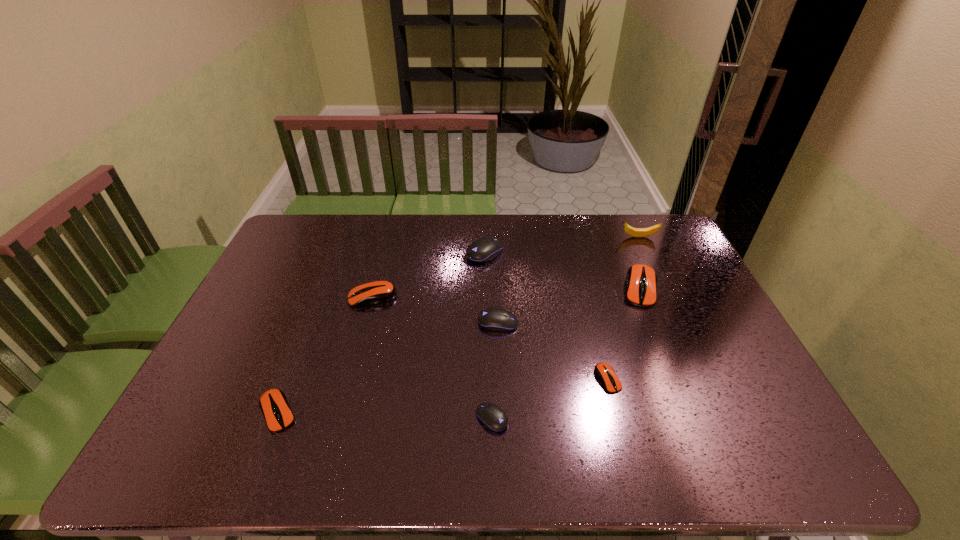
Locate an element on the screen. yellow banana is located at coordinates (635, 232).

Identify the location of the farthest object. (635, 232).

Where is `the rightmost orange computer mouse`? the rightmost orange computer mouse is located at coordinates (641, 280).

The width and height of the screenshot is (960, 540). Identify the location of the biggest orange computer mouse. (641, 280).

This screenshot has width=960, height=540. Identify the location of the farthest computer mouse. (482, 250).

The image size is (960, 540). In order to click on the farthest black computer mouse in this screenshot , I will do `click(482, 250)`.

At what (x,y) coordinates should I click in order to perform the action: click on the second biggest orange computer mouse. Please return your answer as a coordinate pair (x, y). This screenshot has height=540, width=960. Looking at the image, I should click on (378, 292).

Locate an element on the screen. the second orange computer mouse from left to right is located at coordinates (378, 292).

You are a GUI agent. You are given a task and a screenshot of the screen. Output one action in this format:
    pyautogui.click(x=<x>, y=<y>)
    Task: Click on the second smallest black computer mouse
    The width and height of the screenshot is (960, 540).
    Given the screenshot: What is the action you would take?
    pyautogui.click(x=494, y=319)

At what (x,y) coordinates should I click in order to perform the action: click on the fourth nearest object. Please return your answer as a coordinate pair (x, y). Image resolution: width=960 pixels, height=540 pixels. Looking at the image, I should click on (494, 319).